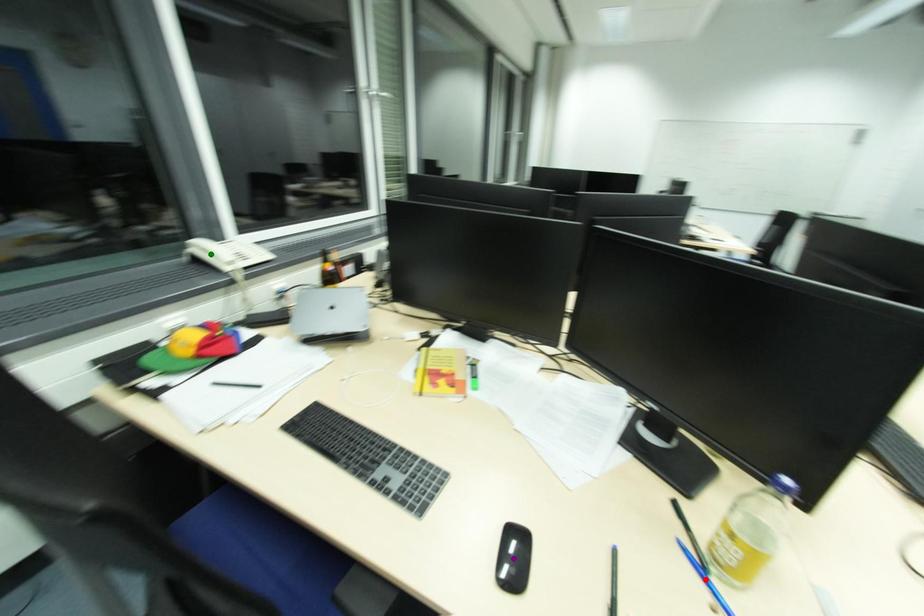
Consider the image. Order these from nearest to farthest:
1. red point
2. green point
3. purple point

1. green point
2. purple point
3. red point